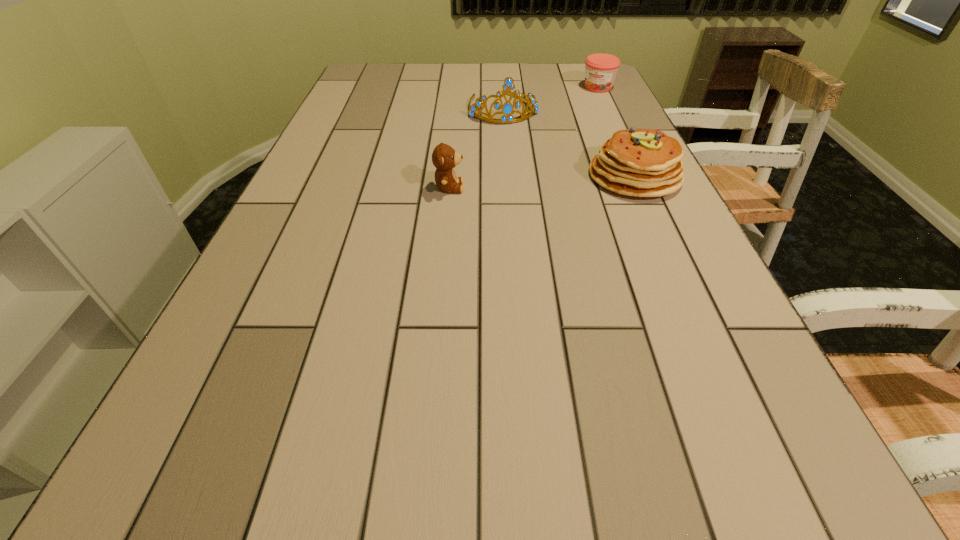
The width and height of the screenshot is (960, 540). Find the location of `vacant space located 0.290m on the front-facing side of the tiara`. vacant space located 0.290m on the front-facing side of the tiara is located at coordinates (528, 179).

At what (x,y) coordinates should I click in order to perform the action: click on vacant space situated 0.120m on the front-facing side of the tiara. Please return your answer as a coordinate pair (x, y). Looking at the image, I should click on (516, 145).

You are a GUI agent. You are given a task and a screenshot of the screen. Output one action in this format:
    pyautogui.click(x=<x>, y=<y>)
    Task: Click on the free space located 0.190m on the front-facing side of the tiara
    This screenshot has height=540, width=960.
    Given the screenshot: What is the action you would take?
    pyautogui.click(x=520, y=158)

Where is `object that is at the far edge`? object that is at the far edge is located at coordinates (600, 69).

Find the location of a particular element. This screenshot has width=960, height=540. pancake situated at the right edge is located at coordinates (636, 162).

You are a GUI agent. You are given a task and a screenshot of the screen. Output one action in this format:
    pyautogui.click(x=<x>, y=<y>)
    Task: Click on the jam present at the right edge
    The height and width of the screenshot is (540, 960).
    Given the screenshot: What is the action you would take?
    pyautogui.click(x=600, y=69)

Find the location of a particular element. Image resolution: width=960 pixels, height=540 pixels. object present at the far right corner is located at coordinates (600, 69).

What are the coordinates of `blank space at the far edge of the desktop` in the screenshot? It's located at (533, 78).

Identify the location of free space at the near edge of the desktop. The height and width of the screenshot is (540, 960). (360, 419).

Image resolution: width=960 pixels, height=540 pixels. Find the location of `blank area at the left edge`. blank area at the left edge is located at coordinates (372, 98).